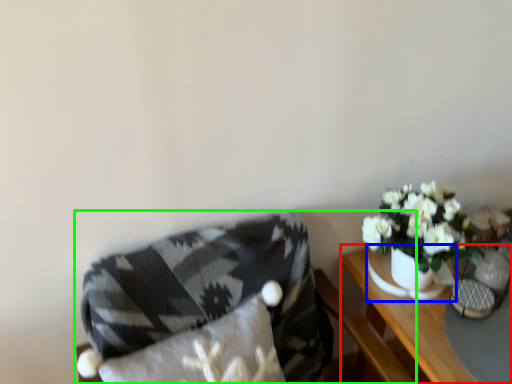
Question: Which is farther away from table (highlighted by a red box)? vase (highlighted by a blue box) or chair (highlighted by a green box)?

Choices:
 (A) vase
 (B) chair

Answer: (B)